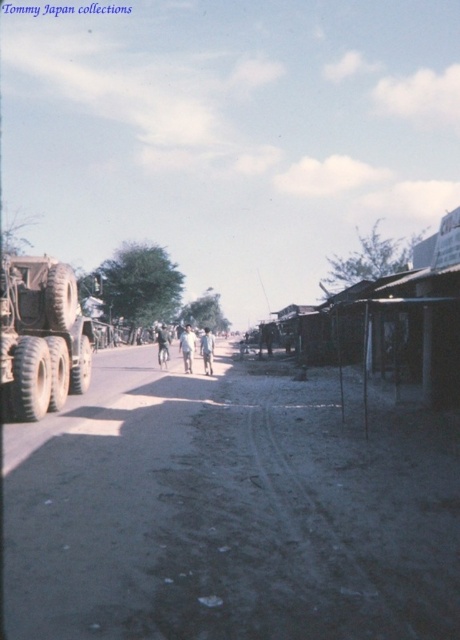
Question: Does wooden shacks at right come in front of light brown fabric pants at center?

Choices:
 (A) no
 (B) yes

Answer: (B)

Question: Estimate the real-world distances between objects in this image. Which object is closer to the light brown fabric pants at center?

Choices:
 (A) matte khaki truck at left
 (B) light blue fabric pants at center

Answer: (B)

Question: Estimate the real-world distances between objects in this image. Which object is closer to the light blue fabric pants at center?

Choices:
 (A) dusty gravel road at center
 (B) matte khaki truck at left
 (C) light blue denim pants at center

Answer: (C)

Question: Observing the image, what is the correct spatial positioning of dusty gravel road at center in reference to matte khaki truck at left?

Choices:
 (A) above
 (B) below

Answer: (B)

Question: Is wooden shacks at right above matte khaki truck at left?

Choices:
 (A) no
 (B) yes

Answer: (B)

Question: Which is farther from the light blue denim pants at center?

Choices:
 (A) light brown fabric pants at center
 (B) wooden shacks at right
 (C) matte khaki truck at left
 (D) dusty gravel road at center

Answer: (D)